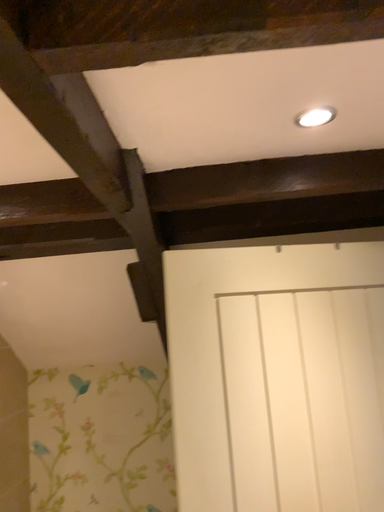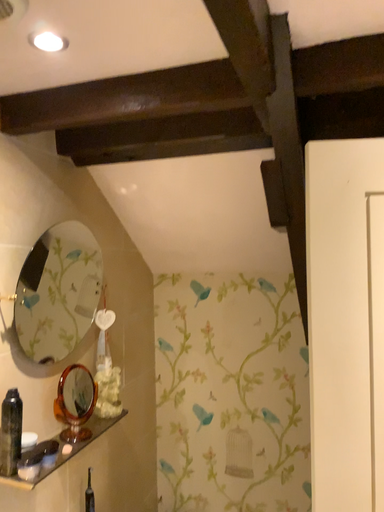
Question: How did the camera likely rotate when shooting the video?

Choices:
 (A) rotated downward
 (B) rotated upward

Answer: (A)